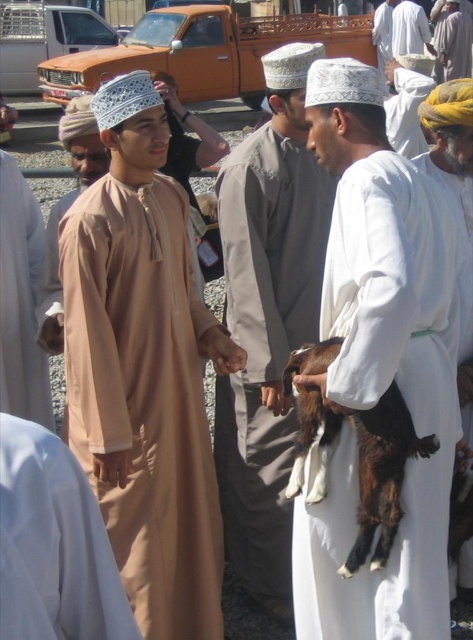
In the scene shown: You are a delivery robot with a width of 1.5 meters. You need to navigate between the light brown fabric robe at center and the white woolen turban at right. Can you fit through the space between them?

The distance between the light brown fabric robe at center and the white woolen turban at right is 2.30 meters, which is wider than the robot width of 1.5 meters. Yes, the robot can fit through the space between them.

You are a photographer trying to capture the light brown fabric robe at center and the white woolen turban at right in the same frame. Which object should you focus on first to ensure both are in focus?

You should focus on the light brown fabric robe at center first because it is closer to the viewer than the white woolen turban at right, so adjusting focus from near to far will help both be in focus.